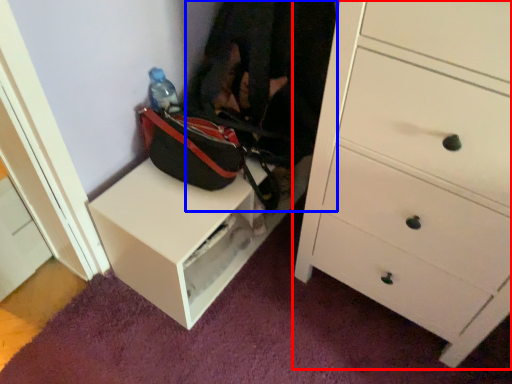
Question: Which object appears closest to the camera in this image, chest of drawers (highlighted by a red box) or clothing (highlighted by a blue box)?

Choices:
 (A) chest of drawers
 (B) clothing

Answer: (A)